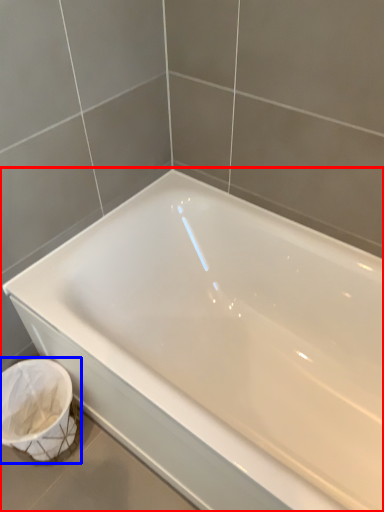
Question: Among these objects, which one is nearest to the camera, bathtub (highlighted by a red box) or laundry basket (highlighted by a blue box)?

Choices:
 (A) bathtub
 (B) laundry basket

Answer: (A)